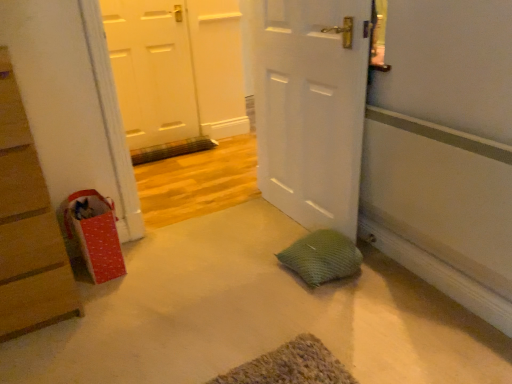
Where is `free space in front of white matte door at center, which appears as the 2th door when viewed from the left`? This screenshot has height=384, width=512. free space in front of white matte door at center, which appears as the 2th door when viewed from the left is located at coordinates (297, 286).